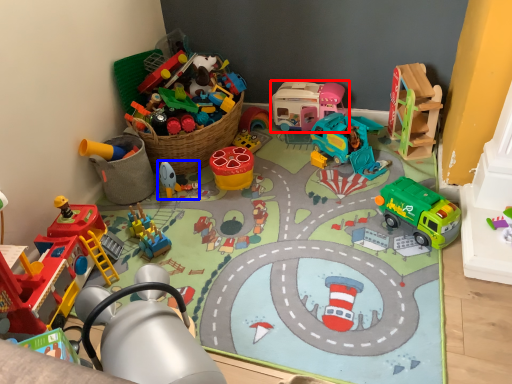
Question: Which of the following is the closest to the observer, toy (highlighted by a red box) or toy (highlighted by a blue box)?

Choices:
 (A) toy
 (B) toy

Answer: (B)